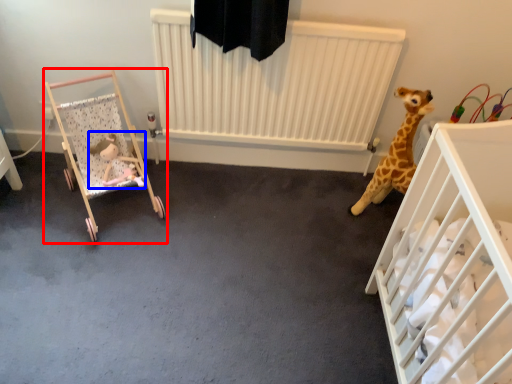
Question: Which object is closer to the camera taking this photo, infant bed (highlighted by a red box) or toy (highlighted by a blue box)?

Choices:
 (A) infant bed
 (B) toy

Answer: (A)